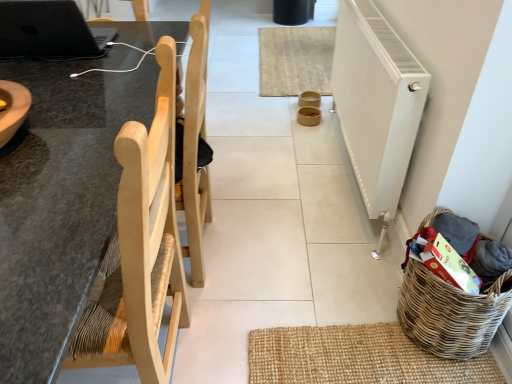
Question: From a real-world perspective, is black matte laptop at upper left positioned above or below woven brown basket at lower right?

Choices:
 (A) below
 (B) above

Answer: (B)

Question: In the image, is black matte laptop at upper left positioned in front of or behind woven brown basket at lower right?

Choices:
 (A) behind
 (B) front

Answer: (A)

Question: Which object is positioned farthest from the white textured radiator at right?

Choices:
 (A) woven brown basket at lower right
 (B) natural wood chair at left
 (C) black matte laptop at upper left
 (D) natural fiber mat at center

Answer: (C)

Question: Estimate the real-world distances between objects in this image. Which object is farther from the natural fiber mat at center?

Choices:
 (A) natural wood chair at left
 (B) black matte laptop at upper left
 (C) white textured radiator at right
 (D) woven brown basket at lower right

Answer: (A)